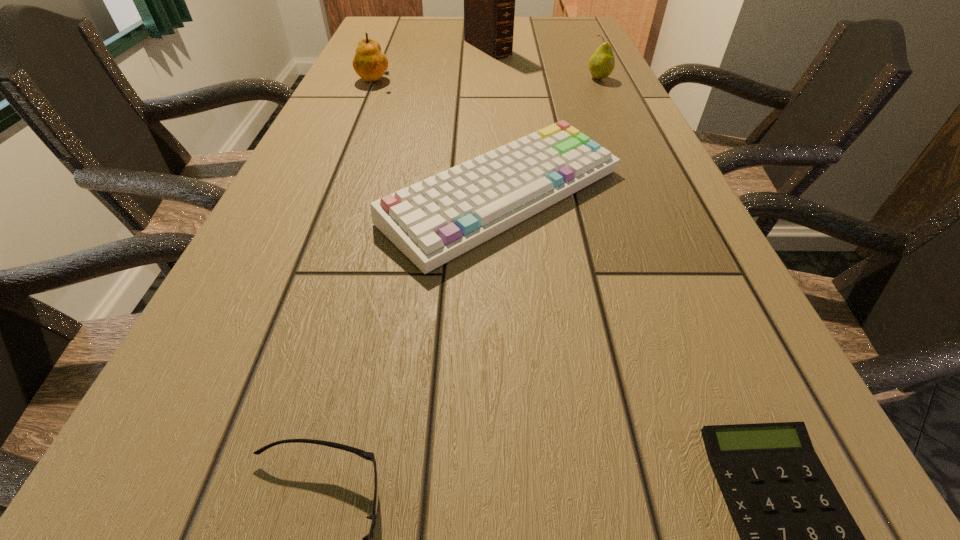
Image resolution: width=960 pixels, height=540 pixels. Find the location of `the closest object to the Bible`. the closest object to the Bible is located at coordinates (370, 63).

You are a GUI agent. You are given a task and a screenshot of the screen. Output one action in this format:
    pyautogui.click(x=<x>, y=<y>)
    Task: Click on the object that is the fourth closest to the tallest object
    The image size is (960, 540).
    Given the screenshot: What is the action you would take?
    click(798, 539)